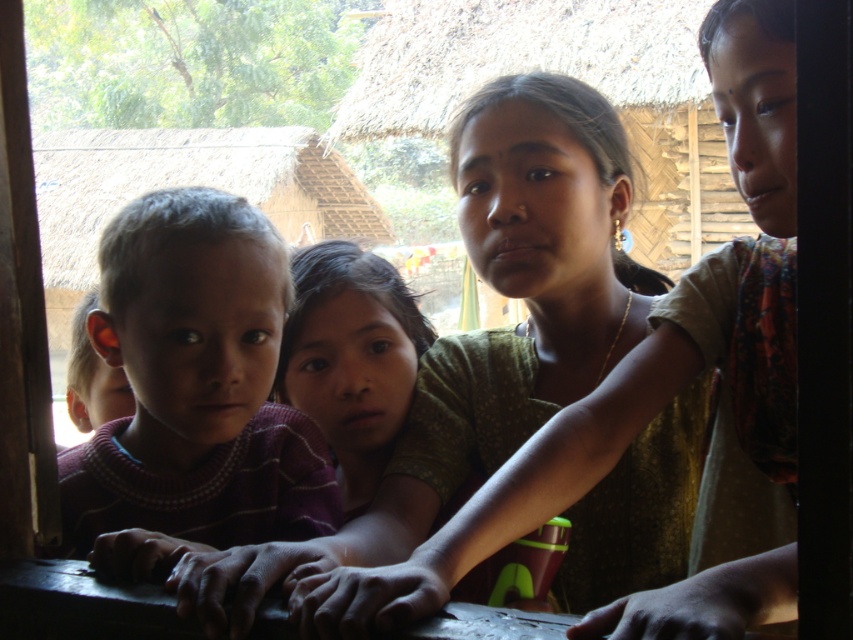
Question: Which point is farther to the camera?

Choices:
 (A) (329, 276)
 (B) (238, 394)

Answer: (A)

Question: Does striped knit sweater at left appear on the right side of matte green shirt at center?

Choices:
 (A) no
 (B) yes

Answer: (A)

Question: Which object appears farthest from the camera in this image?

Choices:
 (A) matte green shirt at center
 (B) striped knit sweater at center

Answer: (A)

Question: Does striped knit sweater at center appear over matte green shirt at center?

Choices:
 (A) no
 (B) yes

Answer: (B)

Question: Which point is farther to the camera?

Choices:
 (A) matte green shirt at center
 (B) striped knit sweater at center
 (C) striped knit sweater at left

Answer: (A)

Question: Is striped knit sweater at center further to the viewer compared to matte green shirt at center?

Choices:
 (A) yes
 (B) no

Answer: (B)